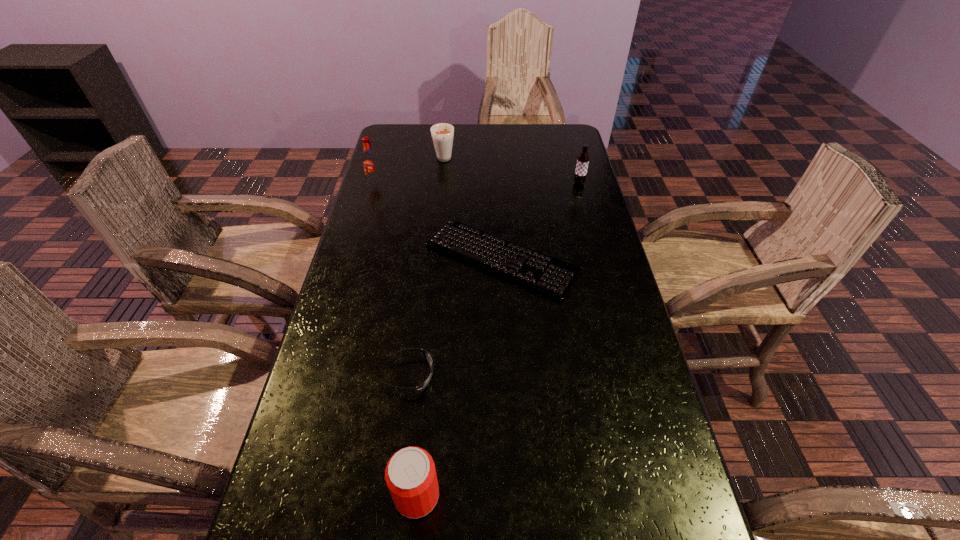
Find the location of a particular element. vacant space situated 0.190m on the drink side of the second root beer from right to left is located at coordinates (440, 199).

Locate an element on the screen. This screenshot has width=960, height=540. vacant space located 0.370m on the front of the rightmost root beer is located at coordinates (600, 261).

Locate an element on the screen. This screenshot has height=540, width=960. vacant space positioned on the back of the nearest object is located at coordinates (426, 389).

Locate an element on the screen. Image resolution: width=960 pixels, height=540 pixels. free point located on the lenses of the fifth tallest object is located at coordinates (548, 375).

What are the coordinates of `free region located 0.400m on the back of the shortest object` in the screenshot? It's located at (496, 154).

Identify the location of object that is at the far edge. (442, 134).

Identify the location of object present at the left edge. The height and width of the screenshot is (540, 960). (370, 163).

Where is `root beer positioned at the right edge`? root beer positioned at the right edge is located at coordinates (583, 159).

At what (x,y) coordinates should I click in order to perform the action: click on computer keyboard present at the right edge. Please return your answer as a coordinate pair (x, y). Looking at the image, I should click on (554, 278).

This screenshot has height=540, width=960. Find the location of `vacant space at the left edge of the desktop`. vacant space at the left edge of the desktop is located at coordinates pyautogui.click(x=401, y=185).